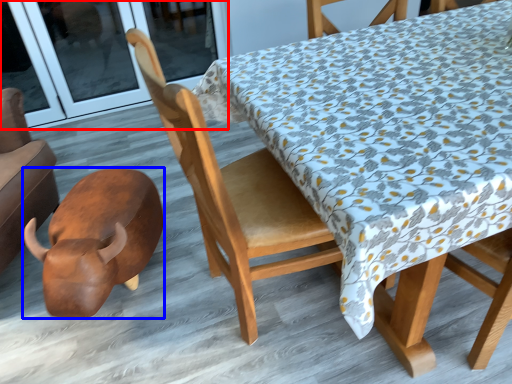
Question: Which point is further to the camera, screen door (highlighted by a red box) or animal (highlighted by a blue box)?

Choices:
 (A) screen door
 (B) animal

Answer: (A)